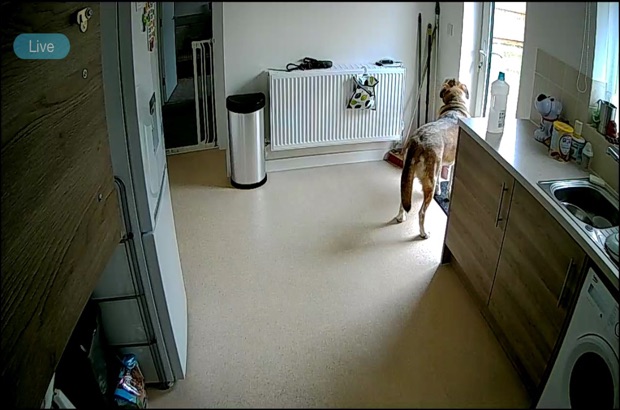
The width and height of the screenshot is (620, 410). Identify the location of heater. (293, 88).